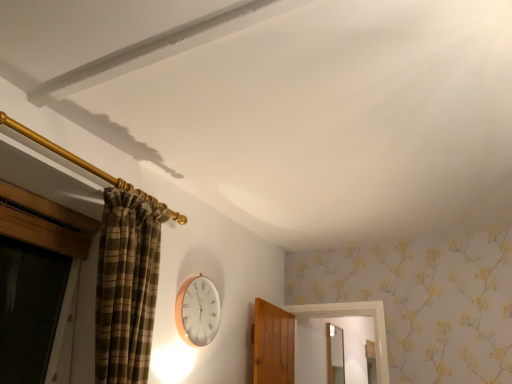
Locate an element on the screen. matte silver mirror at center is located at coordinates (335, 355).

Describe the element at coordinates (335, 355) in the screenshot. I see `matte silver mirror at center` at that location.

Find the location of a particular element. This screenshot has height=384, width=512. white wooden clock at center is located at coordinates (197, 311).

What do you see at coordinates (197, 311) in the screenshot? The image size is (512, 384). I see `white wooden clock at center` at bounding box center [197, 311].

The image size is (512, 384). I want to click on matte silver mirror at center, so click(335, 355).

Considering the positions of objects white wooden clock at center and matte silver mirror at center in the image provided, who is more to the left, white wooden clock at center or matte silver mirror at center?

white wooden clock at center.

Which is in front, white wooden clock at center or matte silver mirror at center?

white wooden clock at center.

Is point (208, 297) less distant than point (330, 377)?

Yes, it is in front of point (330, 377).

From the image's perspective, is white wooden clock at center below matte silver mirror at center?

No, from the image's perspective, white wooden clock at center is not beneath matte silver mirror at center.

From a real-world perspective, is white wooden clock at center above or below matte silver mirror at center?

From a real-world perspective, white wooden clock at center is physically below matte silver mirror at center.

In the scene shown: Is white wooden clock at center thinner than matte silver mirror at center?

Indeed, white wooden clock at center has a lesser width compared to matte silver mirror at center.

Which of these two, white wooden clock at center or matte silver mirror at center, stands shorter?

white wooden clock at center is shorter.

From the picture: Does white wooden clock at center have a smaller size compared to matte silver mirror at center?

Yes.

Is white wooden clock at center inside the boundaries of matte silver mirror at center, or outside?

white wooden clock at center lies outside matte silver mirror at center.

Is white wooden clock at center positioned far away from matte silver mirror at center?

Yes, white wooden clock at center and matte silver mirror at center are located far from each other.

Is white wooden clock at center facing away from matte silver mirror at center?

white wooden clock at center does not have its back to matte silver mirror at center.

Consider the image. How different are the orientations of white wooden clock at center and matte silver mirror at center in degrees?

3.42 degrees.

At what (x,y) coordinates should I click in order to perform the action: click on mirror behind the white wooden clock at center. Please return your answer as a coordinate pair (x, y). This screenshot has height=384, width=512. Looking at the image, I should click on pyautogui.click(x=335, y=355).

Is matte silver mirror at center at the right side of white wooden clock at center?

Indeed, matte silver mirror at center is positioned on the right side of white wooden clock at center.

From the picture: Considering the positions of objects matte silver mirror at center and white wooden clock at center in the image provided, who is in front, matte silver mirror at center or white wooden clock at center?

Positioned in front is white wooden clock at center.

Is point (338, 374) in front of point (205, 278)?

That is False.

From the image's perspective, is matte silver mirror at center under white wooden clock at center?

Yes, from the image's perspective, matte silver mirror at center is beneath white wooden clock at center.

Consider the image. From a real-world perspective, relative to white wooden clock at center, is matte silver mirror at center vertically above or below?

matte silver mirror at center is above white wooden clock at center.

Considering the relative sizes of matte silver mirror at center and white wooden clock at center in the image provided, is matte silver mirror at center wider than white wooden clock at center?

Indeed, matte silver mirror at center has a greater width compared to white wooden clock at center.

Can you confirm if matte silver mirror at center is taller than white wooden clock at center?

Indeed, matte silver mirror at center has a greater height compared to white wooden clock at center.

In the scene shown: Between matte silver mirror at center and white wooden clock at center, which one has larger size?

matte silver mirror at center is bigger.

Looking at this image, is matte silver mirror at center located outside white wooden clock at center?

matte silver mirror at center is positioned outside white wooden clock at center.

Would you say matte silver mirror at center is a long distance from white wooden clock at center?

matte silver mirror at center is far away from white wooden clock at center.

Is white wooden clock at center at the back of matte silver mirror at center?

No, matte silver mirror at center is not facing the opposite direction of white wooden clock at center.

Image resolution: width=512 pixels, height=384 pixels. In order to click on wall clock in front of the matte silver mirror at center in this screenshot , I will do `click(197, 311)`.

At what (x,y) coordinates should I click in order to perform the action: click on wall clock located on the left of matte silver mirror at center. Please return your answer as a coordinate pair (x, y). Looking at the image, I should click on (197, 311).

The width and height of the screenshot is (512, 384). Identify the location of mirror that is above the white wooden clock at center (from a real-world perspective). (335, 355).